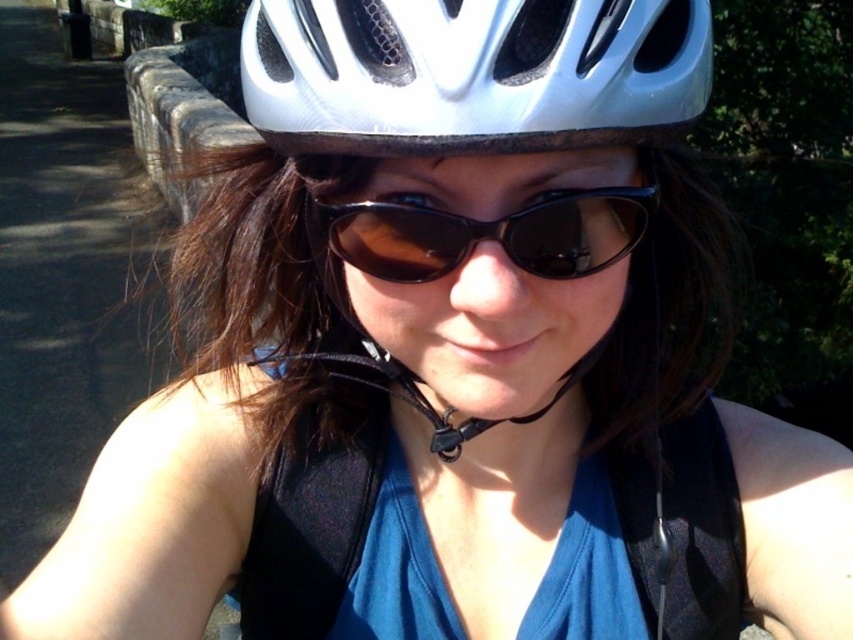
Question: Which object is the closest to the black fabric vest at center?

Choices:
 (A) brown matte sunglasses at center
 (B) white matte bicycle helmet at center
 (C) white matte helmet at center

Answer: (A)

Question: In this image, where is white matte helmet at center located relative to black fabric vest at center?

Choices:
 (A) right
 (B) left

Answer: (B)

Question: Can you confirm if black fabric vest at center is thinner than brown matte sunglasses at center?

Choices:
 (A) yes
 (B) no

Answer: (B)

Question: Which point is farther from the camera taking this photo?

Choices:
 (A) (428, 262)
 (B) (689, 595)
 (C) (639, 131)

Answer: (B)

Question: Can you confirm if white matte helmet at center is smaller than black fabric vest at center?

Choices:
 (A) no
 (B) yes

Answer: (B)

Question: Which object appears farthest from the camera in this image?

Choices:
 (A) white matte bicycle helmet at center
 (B) white matte helmet at center
 (C) brown matte sunglasses at center
 (D) black fabric vest at center

Answer: (D)